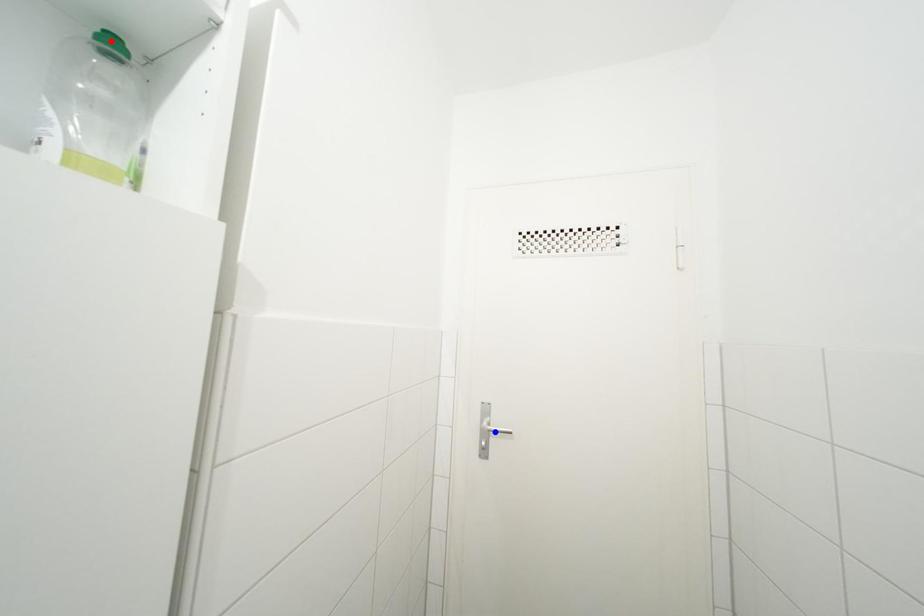
Question: Which of the two points in the image is closer to the camera?

Choices:
 (A) Blue point is closer.
 (B) Red point is closer.

Answer: (B)